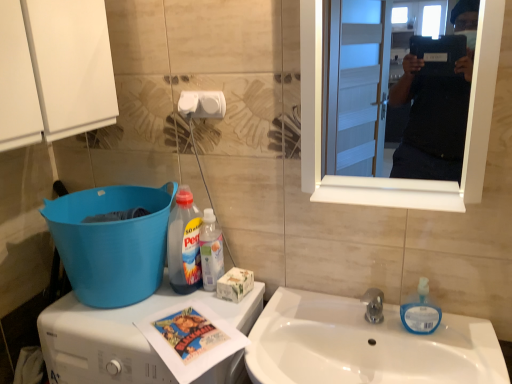
Question: From the image's perspective, is blue translucent soap dispenser at sink right over blue plastic bucket at lower left?

Choices:
 (A) no
 (B) yes

Answer: (A)

Question: Is blue translucent soap dispenser at sink right not close to blue plastic bucket at lower left?

Choices:
 (A) no
 (B) yes

Answer: (A)

Question: Does blue translucent soap dispenser at sink right have a smaller size compared to blue plastic bucket at lower left?

Choices:
 (A) yes
 (B) no

Answer: (A)

Question: From a real-world perspective, is blue translucent soap dispenser at sink right under blue plastic bucket at lower left?

Choices:
 (A) no
 (B) yes

Answer: (B)

Question: Does blue translucent soap dispenser at sink right come in front of blue plastic bucket at lower left?

Choices:
 (A) yes
 (B) no

Answer: (B)

Question: Considering the relative sizes of blue translucent soap dispenser at sink right and blue plastic bucket at lower left in the image provided, is blue translucent soap dispenser at sink right taller than blue plastic bucket at lower left?

Choices:
 (A) yes
 (B) no

Answer: (B)

Question: Is blue translucent soap dispenser at sink right next to white matte toilet paper at upper center?

Choices:
 (A) no
 (B) yes

Answer: (A)

Question: Is blue translucent soap dispenser at sink right at the left side of white matte toilet paper at upper center?

Choices:
 (A) yes
 (B) no

Answer: (B)

Question: Is blue translucent soap dispenser at sink right oriented away from white matte toilet paper at upper center?

Choices:
 (A) no
 (B) yes

Answer: (A)

Question: Does blue translucent soap dispenser at sink right appear on the right side of white matte toilet paper at upper center?

Choices:
 (A) yes
 (B) no

Answer: (A)

Question: From the image's perspective, would you say blue translucent soap dispenser at sink right is positioned over white matte toilet paper at upper center?

Choices:
 (A) yes
 (B) no

Answer: (B)

Question: Considering the relative sizes of blue translucent soap dispenser at sink right and white matte toilet paper at upper center in the image provided, is blue translucent soap dispenser at sink right smaller than white matte toilet paper at upper center?

Choices:
 (A) no
 (B) yes

Answer: (A)

Question: Can you confirm if white glossy mirror at upper right is shorter than translucent plastic bottle at center, acting as the 1th bottle starting from the right?

Choices:
 (A) yes
 (B) no

Answer: (B)